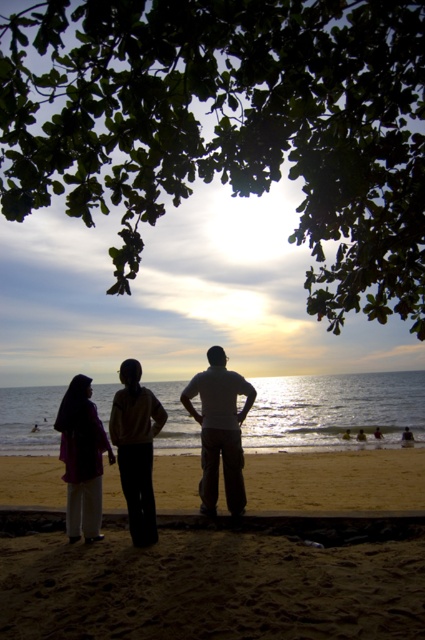
Does point (379, 237) lie in front of point (73, 529)?

Yes, it is in front of point (73, 529).

Who is more forward, (181, 17) or (68, 515)?

Positioned in front is point (181, 17).

The image size is (425, 640). I want to click on green leafy tree at upper center, so click(231, 125).

Can you confirm if green leafy tree at upper center is shorter than smooth golden sand at lower center?

Incorrect, green leafy tree at upper center's height does not fall short of smooth golden sand at lower center's.

Does green leafy tree at upper center have a greater width compared to smooth golden sand at lower center?

In fact, green leafy tree at upper center might be narrower than smooth golden sand at lower center.

Locate an element on the screen. green leafy tree at upper center is located at coordinates (231, 125).

You are a GUI agent. You are given a task and a screenshot of the screen. Output one action in this format:
    pyautogui.click(x=<x>, y=<y>)
    Task: Click on the green leafy tree at upper center
    
    Given the screenshot: What is the action you would take?
    pyautogui.click(x=231, y=125)

Who is more forward, (189,550) or (356,465)?

Positioned in front is point (189,550).

Does point (65, 620) come behind point (104, 488)?

No, (65, 620) is in front of (104, 488).

Where is `sandy beach at lower center`? This screenshot has height=640, width=425. sandy beach at lower center is located at coordinates (198, 572).